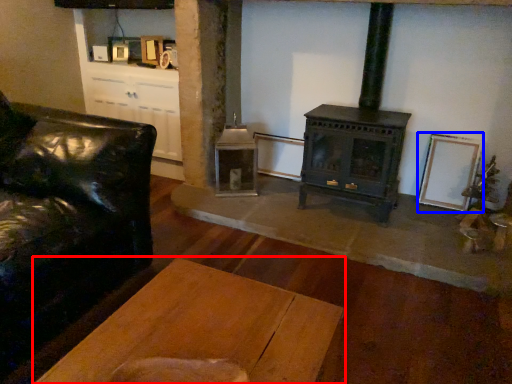
Question: Among these objects, which one is nearest to the camera, table (highlighted by a red box) or picture frame (highlighted by a blue box)?

Choices:
 (A) table
 (B) picture frame

Answer: (A)